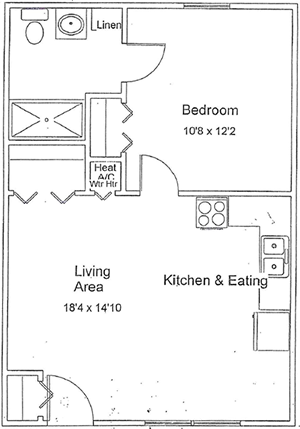
Locate an element on the screen. stove is located at coordinates (207, 212).